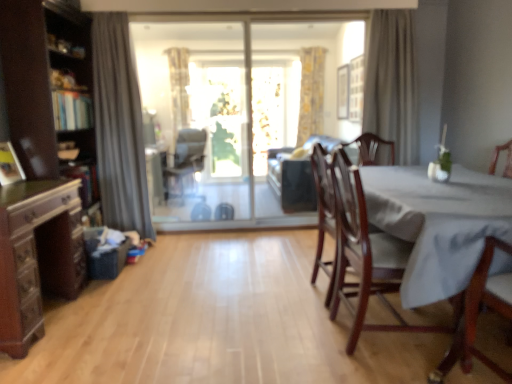
Question: Is matte black chair at center, the first chair in the back-to-front sequence, looking in the opposite direction of transparent glass screen door at center?

Choices:
 (A) no
 (B) yes

Answer: (A)

Question: Considering the relative sizes of matte black chair at center, which is the first chair in left-to-right order, and transparent glass screen door at center in the image provided, is matte black chair at center, which is the first chair in left-to-right order, shorter than transparent glass screen door at center?

Choices:
 (A) no
 (B) yes

Answer: (B)

Question: Could you tell me if matte black chair at center, the first chair in the back-to-front sequence, is turned towards transparent glass screen door at center?

Choices:
 (A) yes
 (B) no

Answer: (B)

Question: Does matte black chair at center, the first chair in the back-to-front sequence, lie in front of transparent glass screen door at center?

Choices:
 (A) yes
 (B) no

Answer: (B)

Question: Can you confirm if matte black chair at center, placed as the third chair when sorted from right to left, is thinner than transparent glass screen door at center?

Choices:
 (A) no
 (B) yes

Answer: (A)

Question: From the image's perspective, is mahogany wood chair at right, marked as the 1th chair in a front-to-back arrangement, positioned above or below transparent glass door at center, the second window screen when ordered from front to back?

Choices:
 (A) below
 (B) above

Answer: (A)

Question: Considering the relative positions of mahogany wood chair at right, the 3th chair in the left-to-right sequence, and transparent glass door at center, the second window screen when ordered from front to back, in the image provided, is mahogany wood chair at right, the 3th chair in the left-to-right sequence, to the left or to the right of transparent glass door at center, the second window screen when ordered from front to back,?

Choices:
 (A) right
 (B) left

Answer: (A)

Question: Is mahogany wood chair at right, marked as the 1th chair in a front-to-back arrangement, inside or outside of transparent glass door at center, the first window screen positioned from the back?

Choices:
 (A) inside
 (B) outside

Answer: (B)

Question: From a real-world perspective, relative to transparent glass door at center, the second window screen when ordered from front to back, is mahogany wood chair at right, which is counted as the third chair, starting from the back, vertically above or below?

Choices:
 (A) above
 (B) below

Answer: (B)

Question: In the image, is beige fabric curtain at upper right, the 2th curtain viewed from the front, positioned in front of or behind matte black chair at center, the first chair in the back-to-front sequence?

Choices:
 (A) front
 (B) behind

Answer: (A)

Question: In terms of height, does beige fabric curtain at upper right, acting as the 2th curtain starting from the back, look taller or shorter compared to matte black chair at center, which is the third chair from front to back?

Choices:
 (A) short
 (B) tall

Answer: (B)

Question: Visually, is beige fabric curtain at upper right, acting as the 2th curtain starting from the back, positioned to the left or to the right of matte black chair at center, the first chair in the back-to-front sequence?

Choices:
 (A) left
 (B) right

Answer: (B)

Question: From the image's perspective, is beige fabric curtain at upper right, acting as the 2th curtain starting from the back, above or below matte black chair at center, the first chair in the back-to-front sequence?

Choices:
 (A) above
 (B) below

Answer: (A)

Question: Would you say mahogany wood chair at right, the 2th chair positioned from the right, is to the left or to the right of beige fabric curtain at upper right, acting as the 2th curtain starting from the back, in the picture?

Choices:
 (A) left
 (B) right

Answer: (A)

Question: Is mahogany wood chair at right, positioned as the second chair in back-to-front order, wider or thinner than beige fabric curtain at upper right, acting as the 3th curtain starting from the left?

Choices:
 (A) wide
 (B) thin

Answer: (A)